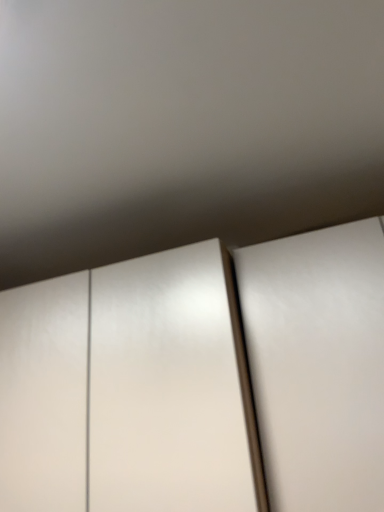
Question: Should I look upward or downward to see white glossy door at right?

Choices:
 (A) down
 (B) up

Answer: (A)

Question: From the image's perspective, is white glossy cupboard at center under white glossy door at right?

Choices:
 (A) yes
 (B) no

Answer: (A)

Question: From a real-world perspective, is white glossy cupboard at center below white glossy door at right?

Choices:
 (A) yes
 (B) no

Answer: (B)

Question: Is white glossy cupboard at center looking in the opposite direction of white glossy door at right?

Choices:
 (A) no
 (B) yes

Answer: (A)

Question: Considering the relative sizes of white glossy cupboard at center and white glossy door at right in the image provided, is white glossy cupboard at center bigger than white glossy door at right?

Choices:
 (A) no
 (B) yes

Answer: (B)

Question: Is white glossy cupboard at center wider than white glossy door at right?

Choices:
 (A) yes
 (B) no

Answer: (B)

Question: From the image's perspective, is white glossy cupboard at center located above white glossy door at right?

Choices:
 (A) yes
 (B) no

Answer: (B)

Question: Is white glossy door at right next to white glossy cupboard at center?

Choices:
 (A) yes
 (B) no

Answer: (B)

Question: Does white glossy door at right come in front of white glossy cupboard at center?

Choices:
 (A) yes
 (B) no

Answer: (A)

Question: Could you tell me if white glossy door at right is facing white glossy cupboard at center?

Choices:
 (A) no
 (B) yes

Answer: (A)

Question: From a real-world perspective, is white glossy door at right physically below white glossy cupboard at center?

Choices:
 (A) no
 (B) yes

Answer: (B)

Question: Is white glossy door at right smaller than white glossy cupboard at center?

Choices:
 (A) no
 (B) yes

Answer: (B)

Question: Considering the relative sizes of white glossy door at right and white glossy cupboard at center in the image provided, is white glossy door at right bigger than white glossy cupboard at center?

Choices:
 (A) no
 (B) yes

Answer: (A)

Question: Considering the relative positions of white glossy door at right and white glossy cupboard at center in the image provided, is white glossy door at right to the left or to the right of white glossy cupboard at center?

Choices:
 (A) right
 (B) left

Answer: (A)